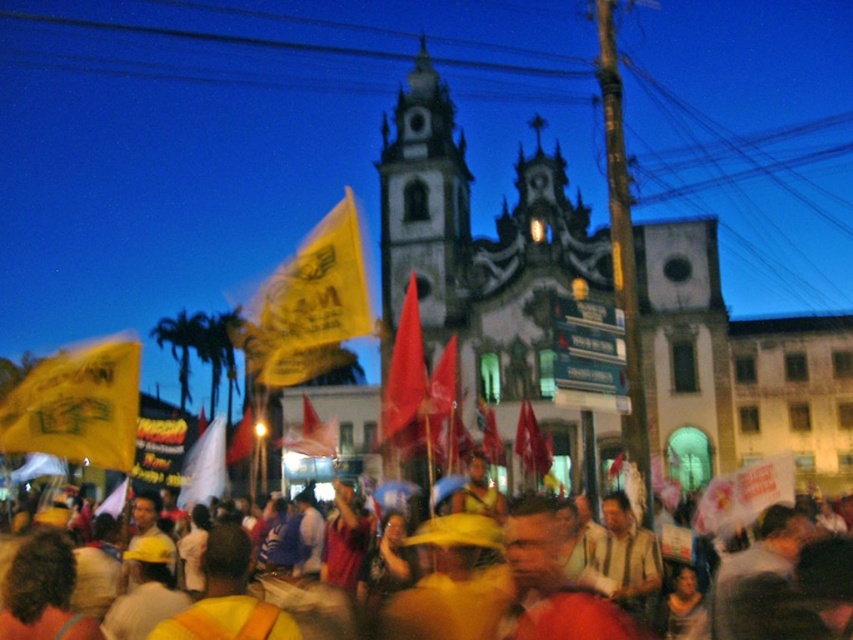
Question: Which is nearer to the yellow fabric flag at center?

Choices:
 (A) yellow hard hats at center
 (B) yellow paper flag at left
 (C) white paper flag at center
 (D) yellow paper flag at center

Answer: (C)

Question: Can you confirm if yellow paper flag at left is positioned above yellow fabric flag at center?

Choices:
 (A) no
 (B) yes

Answer: (B)

Question: Which is farther from the matte red flag at center?

Choices:
 (A) yellow paper flag at left
 (B) red fabric flag at center
 (C) yellow hard hats at center
 (D) yellow fabric flag at center

Answer: (A)

Question: Is yellow paper flag at center positioned at the back of yellow hard hats at center?

Choices:
 (A) no
 (B) yes

Answer: (B)

Question: Which point appears farthest from the camera in this image?

Choices:
 (A) (531, 406)
 (B) (259, 316)
 (C) (248, 452)

Answer: (B)

Question: Is matte red flag at center to the left of white paper flag at center from the viewer's perspective?

Choices:
 (A) yes
 (B) no

Answer: (B)